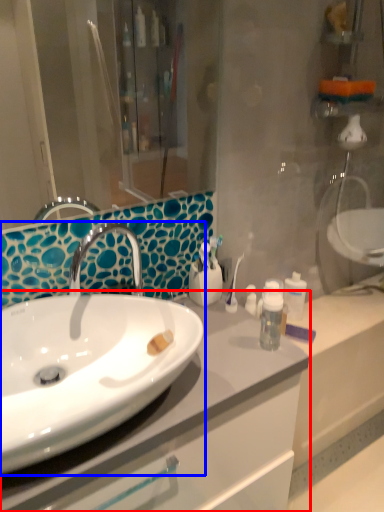
Question: Among these objects, which one is nearest to the camera, bathroom cabinet (highlighted by a red box) or sink (highlighted by a blue box)?

Choices:
 (A) bathroom cabinet
 (B) sink

Answer: (B)